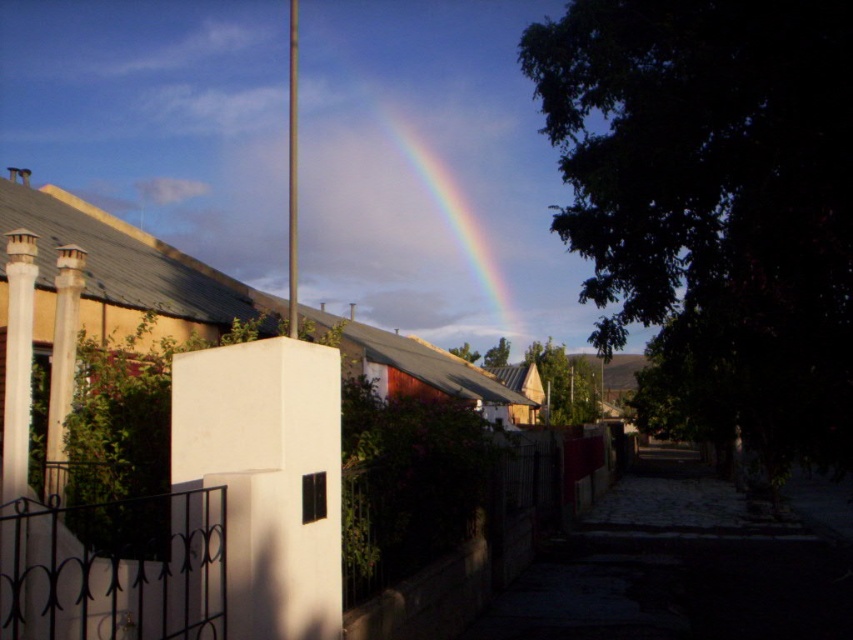
Is white matte pillar at center below white concrete pillar at left?

Correct, white matte pillar at center is located below white concrete pillar at left.

Who is more forward, (299,454) or (59,380)?

Point (299,454) is more forward.

I want to click on white matte pillar at center, so click(267, 477).

Where is `white matte pillar at center`? white matte pillar at center is located at coordinates pos(267,477).

Can you confirm if white matte pillar at center is positioned above rainbow at upper center?

No, white matte pillar at center is not above rainbow at upper center.

Does white matte pillar at center have a lesser height compared to rainbow at upper center?

Correct, white matte pillar at center is not as tall as rainbow at upper center.

Image resolution: width=853 pixels, height=640 pixels. What do you see at coordinates (267, 477) in the screenshot? I see `white matte pillar at center` at bounding box center [267, 477].

Where is `white matte pillar at center`? Image resolution: width=853 pixels, height=640 pixels. white matte pillar at center is located at coordinates (267, 477).

Does point (415, 154) lie behind point (53, 337)?

That is True.

Is rainbow at upper center further to the viewer compared to white concrete pillar at left?

Yes, it is.

I want to click on rainbow at upper center, so click(x=434, y=212).